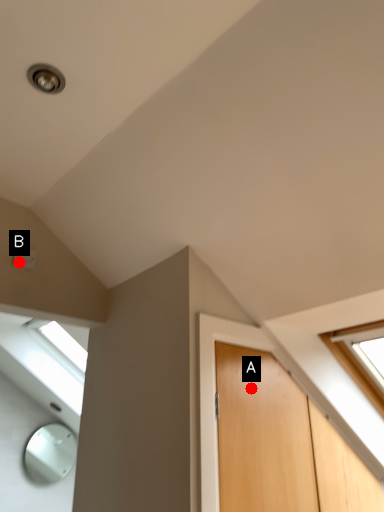
Question: Two points are circled on the image, labeled by A and B beside each circle. Which point is farther to the camera?

Choices:
 (A) A is further
 (B) B is further

Answer: (B)